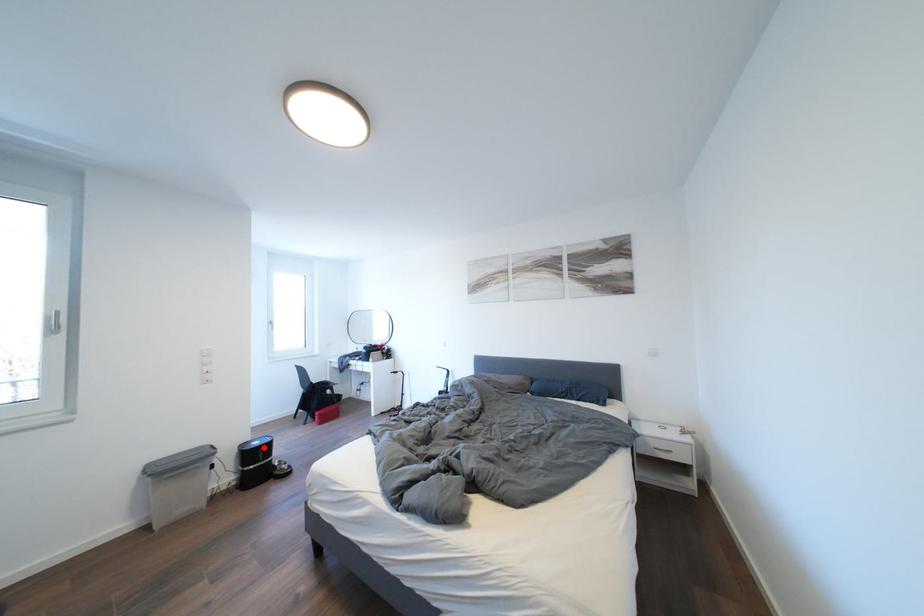
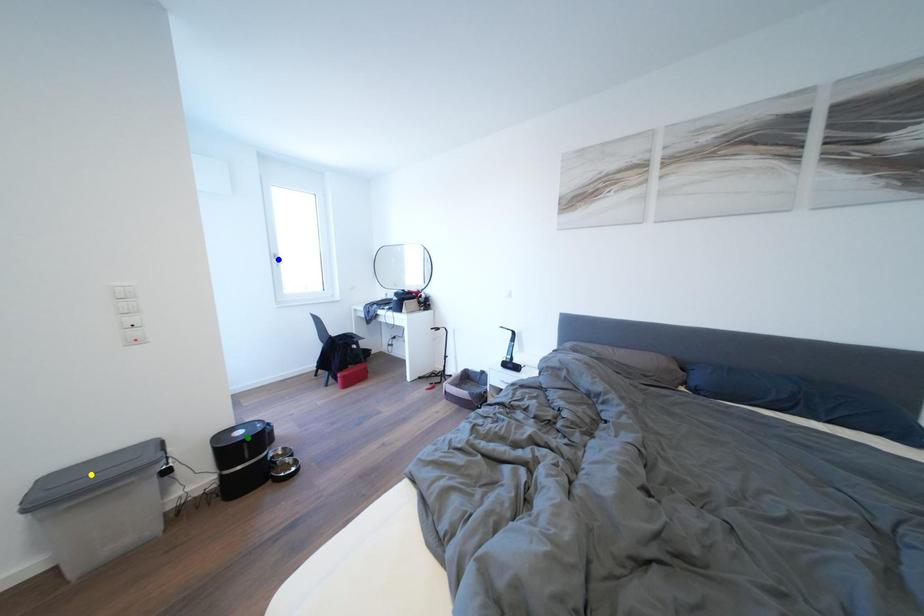
Question: I am providing you with two images of the same scene from different viewpoints. A red point is marked on the first image. You are given multiple points on the second image. Which spot in image 2 lines up with the point in image 1?

Choices:
 (A) yellow point
 (B) green point
 (C) blue point

Answer: (B)